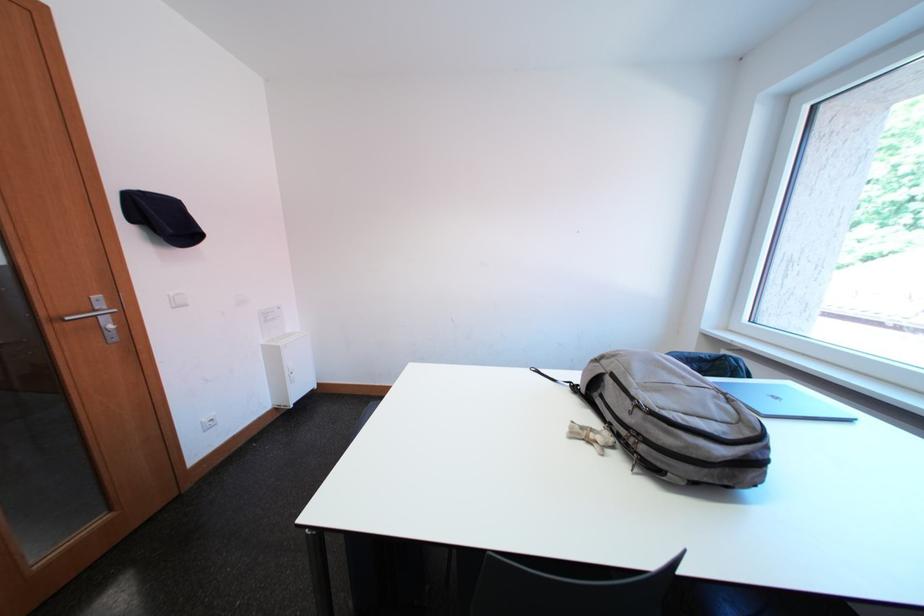
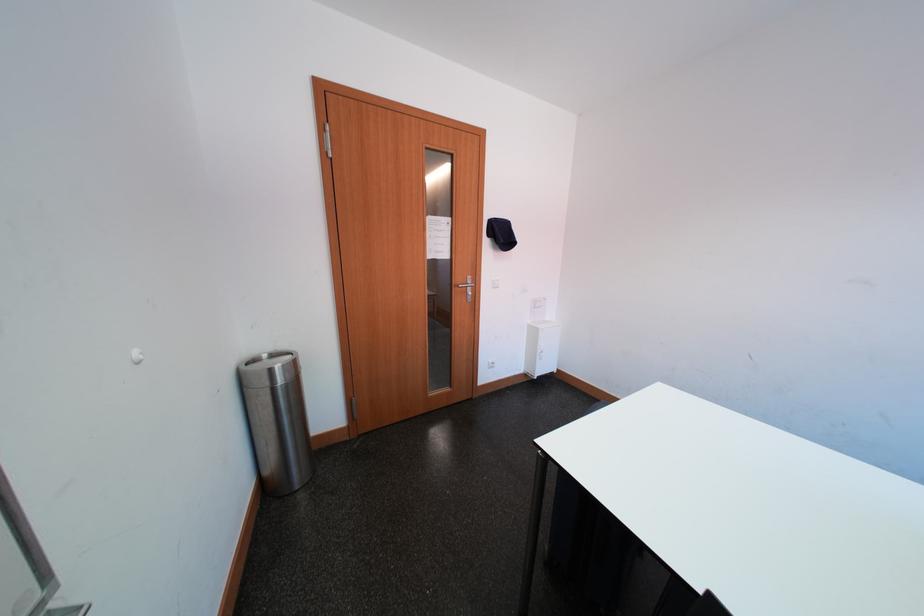
Question: The images are taken continuously from a first-person perspective. In which direction is your viewpoint rotating?

Choices:
 (A) Left
 (B) Right
 (C) Up
 (D) Down

Answer: (A)